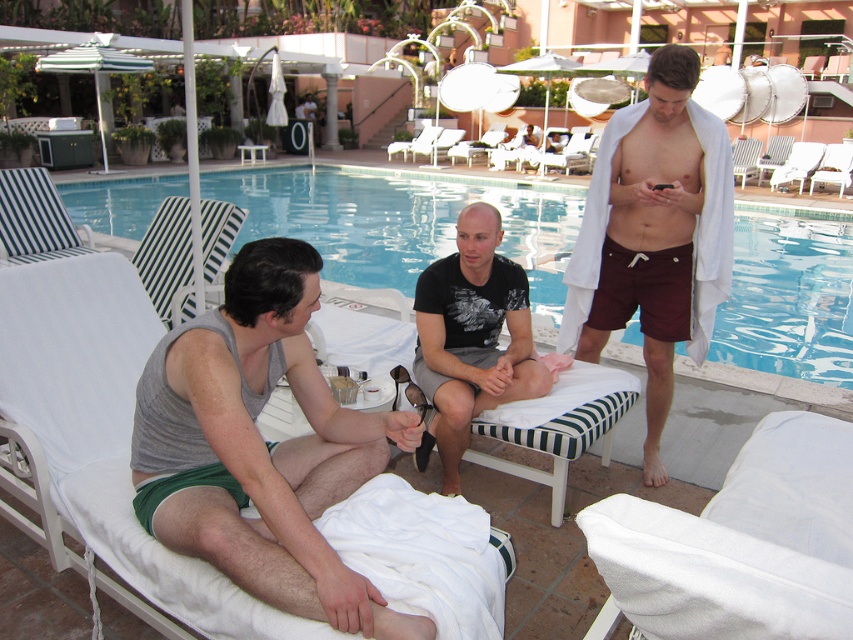
You are a photographer trying to capture a photo of the gray tank top at center and the blue tile swimming pool at center. Which object should you focus on first if you want to ensure both are in the frame without moving the camera?

The gray tank top at center is smaller than the blue tile swimming pool at center, so you should focus on the gray tank top at center first to ensure it fits within the frame since it is smaller and might require more precise framing.

You are standing at the point with coordinates point (440, 330) and want to walk straight towards the point with coordinates point (682, 305). Will you pass by the person in the middle before reaching your destination?

Yes, because point (682, 305) is behind point (440, 330), so walking straight towards it would require passing by the person in the middle first.

You are a hotel guest who wants to borrow a towel. You see the gray tank top at center and the maroon fabric shorts at right. Which one is closer to the pool area?

The gray tank top at center is shorter than maroon fabric shorts at right, so the gray tank top at center is closer to the pool area.